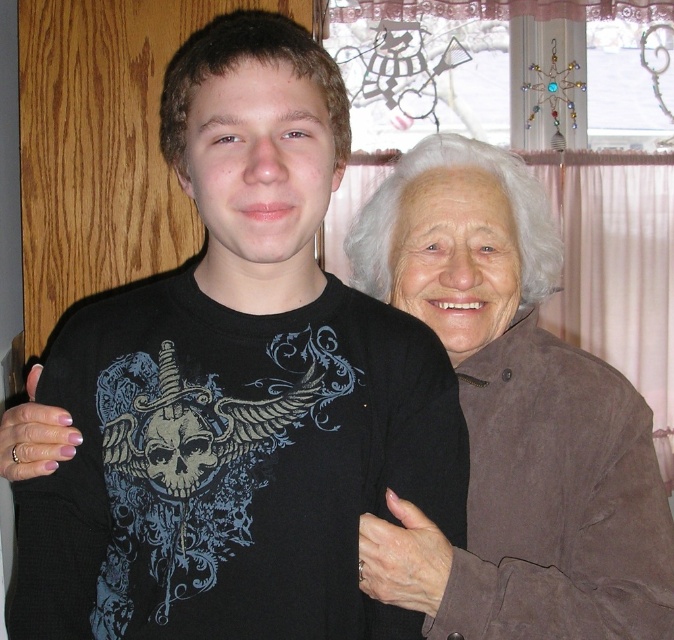
Question: Among these objects, which one is nearest to the camera?

Choices:
 (A) nail polish at left
 (B) smooth brown hand at lower right
 (C) black matte t-shirt at center

Answer: (C)

Question: Observing the image, what is the correct spatial positioning of white suede jacket at upper right in reference to smooth brown hand at lower right?

Choices:
 (A) left
 (B) right

Answer: (B)

Question: Does black matte t-shirt at center have a greater width compared to smooth brown hand at lower right?

Choices:
 (A) no
 (B) yes

Answer: (B)

Question: Among these objects, which one is farthest from the camera?

Choices:
 (A) black matte t-shirt at center
 (B) nail polish at left
 (C) white suede jacket at upper right
 (D) smooth brown hand at lower right

Answer: (D)

Question: Estimate the real-world distances between objects in this image. Which object is closer to the smooth brown hand at lower right?

Choices:
 (A) black matte t-shirt at center
 (B) white suede jacket at upper right
 (C) nail polish at left

Answer: (A)

Question: From the image, what is the correct spatial relationship of white suede jacket at upper right in relation to smooth brown hand at lower right?

Choices:
 (A) left
 (B) right

Answer: (B)